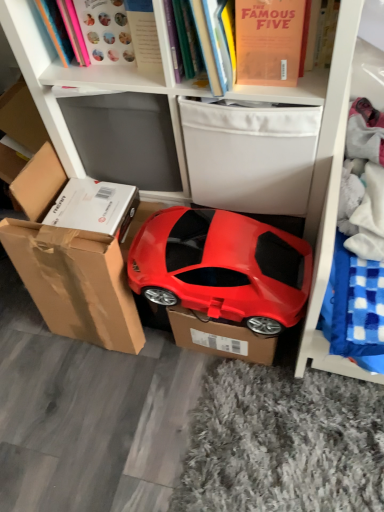
Where is `vacant space that is to the left of brown cardboard box at lower left`? vacant space that is to the left of brown cardboard box at lower left is located at coordinates (31, 348).